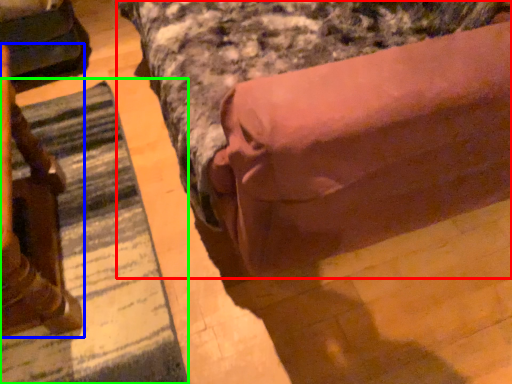
Question: Estimate the real-world distances between objects in this image. Which object is closer to bed (highlighted by a red box), furniture (highlighted by a blue box) or mat (highlighted by a green box)?

Choices:
 (A) furniture
 (B) mat

Answer: (B)